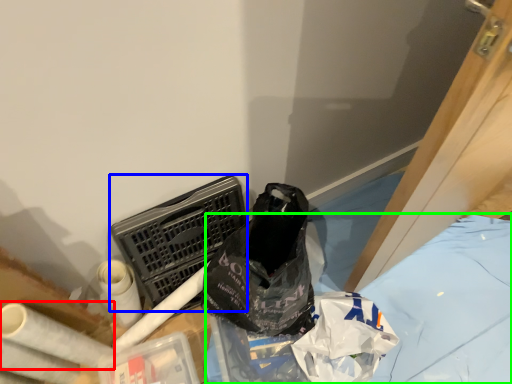
Question: Which object is the closest to the toilet paper (highlighted by a red box)? Choose among these: laundry basket (highlighted by a blue box) or sheet (highlighted by a green box).

Choices:
 (A) laundry basket
 (B) sheet

Answer: (A)